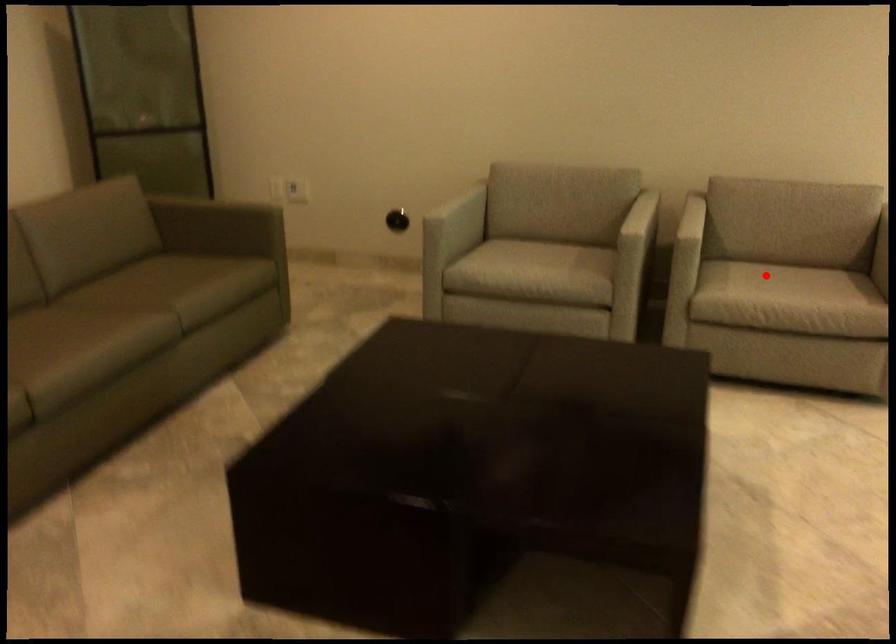
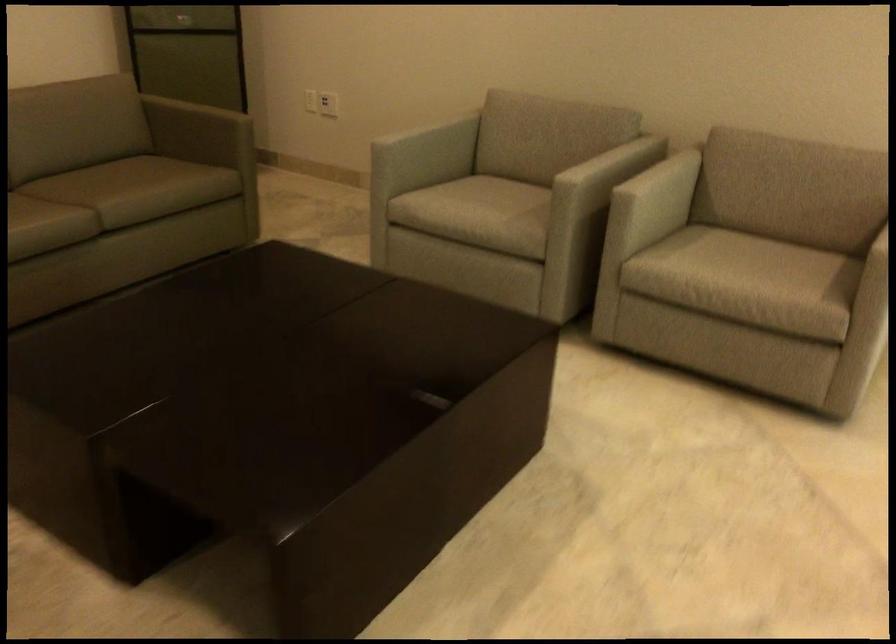
Find the pixel in the second image that matches the highlighted location in the first image.

(739, 257)